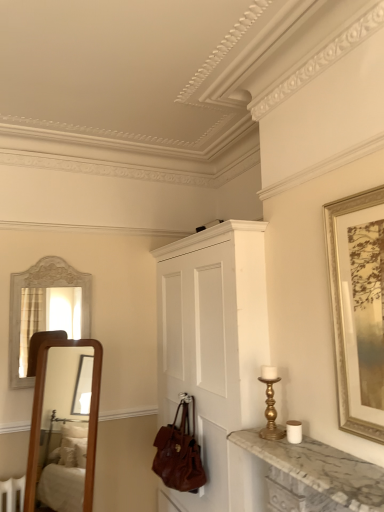
You are a GUI agent. You are given a task and a screenshot of the screen. Output one action in this format:
    pyautogui.click(x=<x>, y=<y>)
    Task: Click on the vacant region in front of gold metallic candle holder at right
    This screenshot has height=512, width=384.
    Given the screenshot: What is the action you would take?
    pyautogui.click(x=297, y=455)